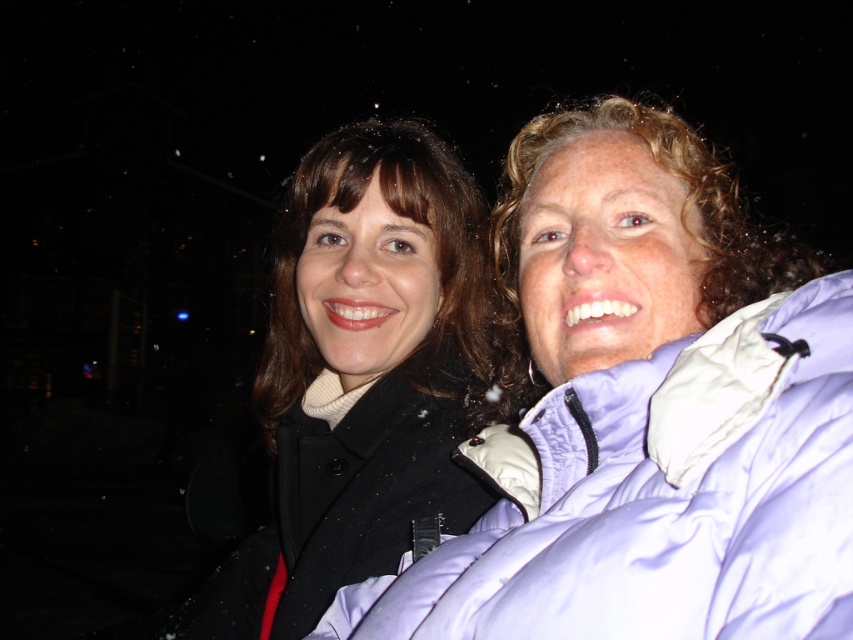
You are standing in the scene and want to hand a scarf to the person wearing the light purple puffy jacket at right. Given that you are facing the same direction as the camera, which direction should you move to reach them?

Since the light purple puffy jacket at right is located at point 0.780 on the x and 0.777 on the y coordinate, you should move to the right and slightly forward to reach the person wearing the light purple puffy jacket at right.

You are an assistant who needs to determine the relative sizes of two coats in the scene. Given that you see the light purple puffy jacket at right and the matte black coat at center, which one is smaller?

The light purple puffy jacket at right has a smaller size compared to the matte black coat at center, so the light purple puffy jacket at right is smaller.